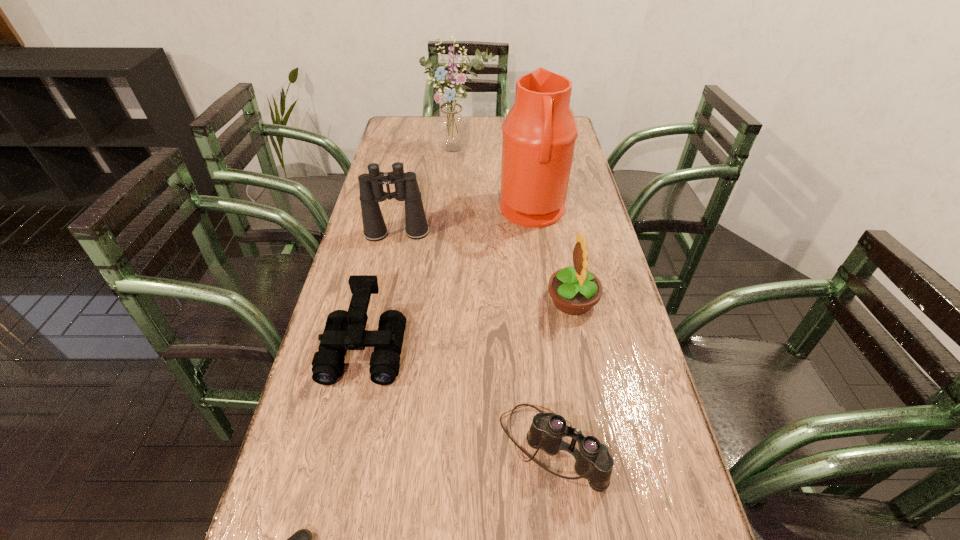
Find the location of a particular element. The width and height of the screenshot is (960, 540). binoculars that stands as the closest to the farthest binoculars is located at coordinates (344, 330).

Where is `the second closest binoculars to the bouquet`? This screenshot has width=960, height=540. the second closest binoculars to the bouquet is located at coordinates (344, 330).

Locate an element on the screen. This screenshot has height=540, width=960. vacant region that satisfies the following two spatial constraints: 1. on the front lenses of the sixth farthest object; 2. on the right side of the second shortest binoculars is located at coordinates (343, 447).

Where is `vacant region that satisfies the following two spatial constraints: 1. on the front lenses of the sixth farthest object; 2. on the right side of the second nearest binoculars`? The image size is (960, 540). vacant region that satisfies the following two spatial constraints: 1. on the front lenses of the sixth farthest object; 2. on the right side of the second nearest binoculars is located at coordinates (343, 447).

Find the location of a particular element. The width and height of the screenshot is (960, 540). vacant position in the image that satisfies the following two spatial constraints: 1. from the spout of the water jug; 2. on the front side of the farthest binoculars is located at coordinates (536, 233).